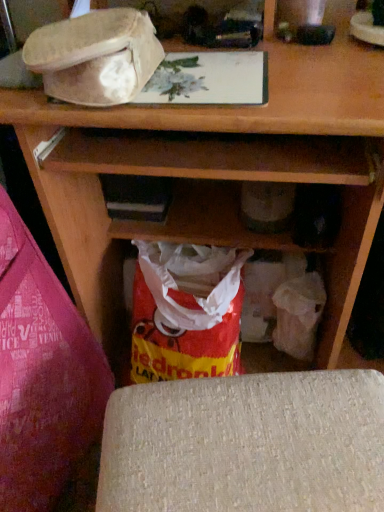
You are a GUI agent. You are given a task and a screenshot of the screen. Output one action in this format:
    pyautogui.click(x=<x>, y=<y>)
    Task: Click on the empty space that is ontop of textured beige cushion at lower center
    The height and width of the screenshot is (512, 384).
    Given the screenshot: What is the action you would take?
    pyautogui.click(x=251, y=430)